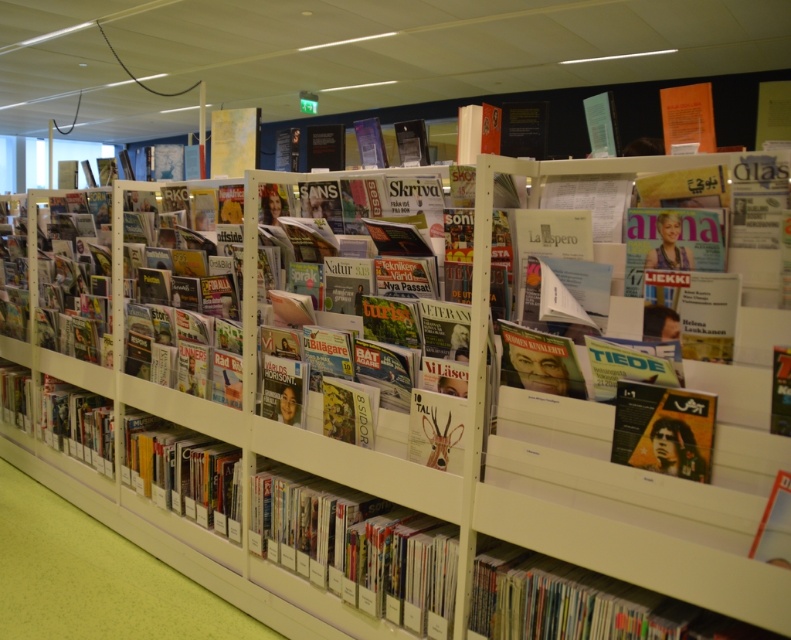
You are a librarian who needs to place a new book that is 15 cm in height. The matte plastic books at center and the matte black book at lower left are currently on the shelf. Which of these two existing books can the new book fit between if the new book is smaller than both?

The new book can fit between the matte plastic books at center and the matte black book at lower left because it is smaller than both.

You are a librarian who needs to place a new book on the shelf. The new book is 3 feet wide. There is a space between the matte plastic books at center and the matte black book at lower left. Can the new book fit in that space?

The space between the matte plastic books at center and the matte black book at lower left is 5.72 feet wide. Since the new book is only 3 feet wide, it can fit in the space.

You are organizing a library shelf and need to place two items side by side. You have the matte plastic books at center and the matte black book at lower left. Which item requires more horizontal space on the shelf?

The matte black book at lower left requires more horizontal space because it has a greater width than the matte plastic books at center.